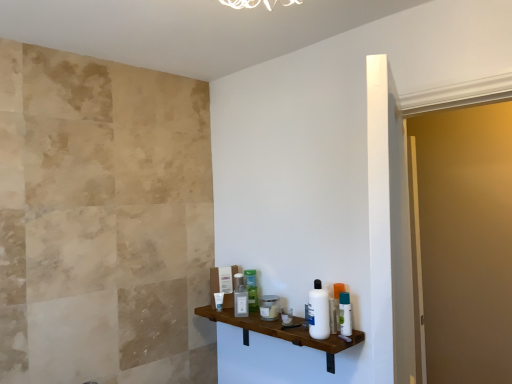
Question: Considering the relative positions of white glossy lotion at center, the 2th toiletry when ordered from left to right, and matte glass jar at center, placed as the 4th toiletry when sorted from front to back, in the image provided, is white glossy lotion at center, the 2th toiletry when ordered from left to right, to the right of matte glass jar at center, placed as the 4th toiletry when sorted from front to back, from the viewer's perspective?

Choices:
 (A) yes
 (B) no

Answer: (B)

Question: Is white glossy lotion at center, the 2th toiletry when ordered from left to right, thinner than matte glass jar at center, which is counted as the fourth toiletry, starting from the left?

Choices:
 (A) no
 (B) yes

Answer: (B)

Question: Considering the relative positions of white glossy lotion at center, the 2th toiletry when ordered from left to right, and matte glass jar at center, positioned as the fourth toiletry in right-to-left order, in the image provided, is white glossy lotion at center, the 2th toiletry when ordered from left to right, to the left of matte glass jar at center, positioned as the fourth toiletry in right-to-left order, from the viewer's perspective?

Choices:
 (A) yes
 (B) no

Answer: (A)

Question: Considering the relative sizes of white glossy lotion at center, the 2th toiletry when ordered from left to right, and matte glass jar at center, positioned as the fourth toiletry in right-to-left order, in the image provided, is white glossy lotion at center, the 2th toiletry when ordered from left to right, smaller than matte glass jar at center, positioned as the fourth toiletry in right-to-left order,?

Choices:
 (A) yes
 (B) no

Answer: (A)

Question: From the image's perspective, is white glossy lotion at center, the 3th toiletry in the back-to-front sequence, located above matte glass jar at center, the 4th toiletry when ordered from back to front?

Choices:
 (A) no
 (B) yes

Answer: (B)

Question: Considering the positions of point (318, 291) and point (245, 276), is point (318, 291) closer or farther from the camera than point (245, 276)?

Choices:
 (A) closer
 (B) farther

Answer: (A)

Question: From a real-world perspective, relative to green plastic bottle at center, marked as the 6th toiletry in a front-to-back arrangement, is white plastic bottle at shelf, which appears as the seventh toiletry when viewed from the back, vertically above or below?

Choices:
 (A) below
 (B) above

Answer: (B)

Question: Is white plastic bottle at shelf, the second toiletry in the right-to-left sequence, to the left or to the right of green plastic bottle at center, the fifth toiletry in the right-to-left sequence, in the image?

Choices:
 (A) right
 (B) left

Answer: (A)

Question: In the image, is white plastic bottle at shelf, which appears as the seventh toiletry when viewed from the back, positioned in front of or behind green plastic bottle at center, acting as the second toiletry starting from the back?

Choices:
 (A) front
 (B) behind

Answer: (A)

Question: From the image's perspective, is white glossy lotion at center, the 3th toiletry in the back-to-front sequence, located above or below white plastic bottle at right, the 7th toiletry positioned from the left?

Choices:
 (A) below
 (B) above

Answer: (A)

Question: Based on their sizes in the image, would you say white glossy lotion at center, positioned as the sixth toiletry in right-to-left order, is bigger or smaller than white plastic bottle at right, which is the 6th toiletry from back to front?

Choices:
 (A) big
 (B) small

Answer: (A)

Question: Is white glossy lotion at center, the 3th toiletry in the back-to-front sequence, in front of or behind white plastic bottle at right, the 2th toiletry in the front-to-back sequence, in the image?

Choices:
 (A) behind
 (B) front

Answer: (A)

Question: Is white glossy lotion at center, the 3th toiletry in the back-to-front sequence, wider or thinner than white plastic bottle at right, which is the 6th toiletry from back to front?

Choices:
 (A) thin
 (B) wide

Answer: (A)

Question: Considering the positions of white plastic bottle at right, which is the 6th toiletry from back to front, and white plastic bottle at shelf, the second toiletry in the right-to-left sequence, in the image, is white plastic bottle at right, which is the 6th toiletry from back to front, taller or shorter than white plastic bottle at shelf, the second toiletry in the right-to-left sequence,?

Choices:
 (A) short
 (B) tall

Answer: (A)

Question: Is white plastic bottle at right, the 2th toiletry in the front-to-back sequence, inside or outside of white plastic bottle at shelf, the 6th toiletry when ordered from left to right?

Choices:
 (A) outside
 (B) inside

Answer: (A)